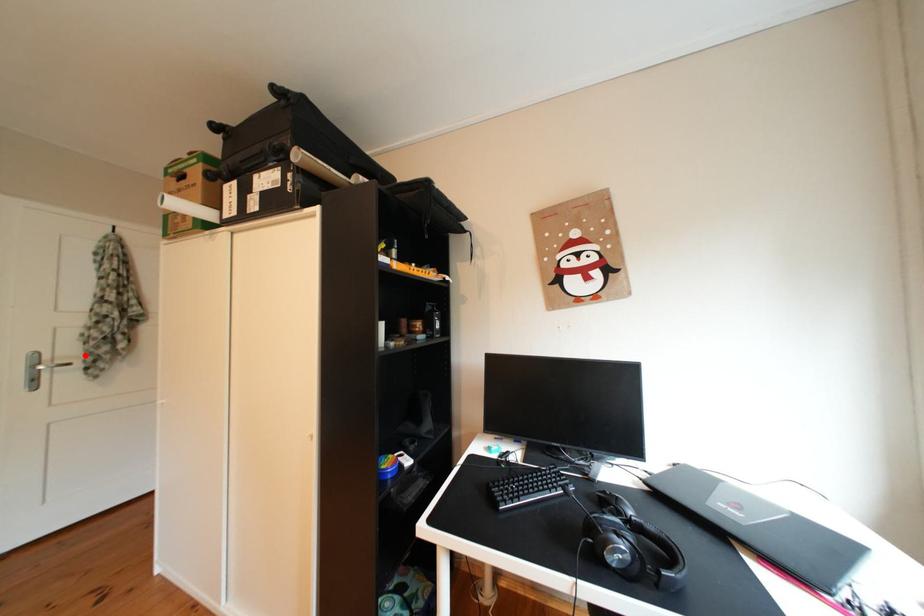
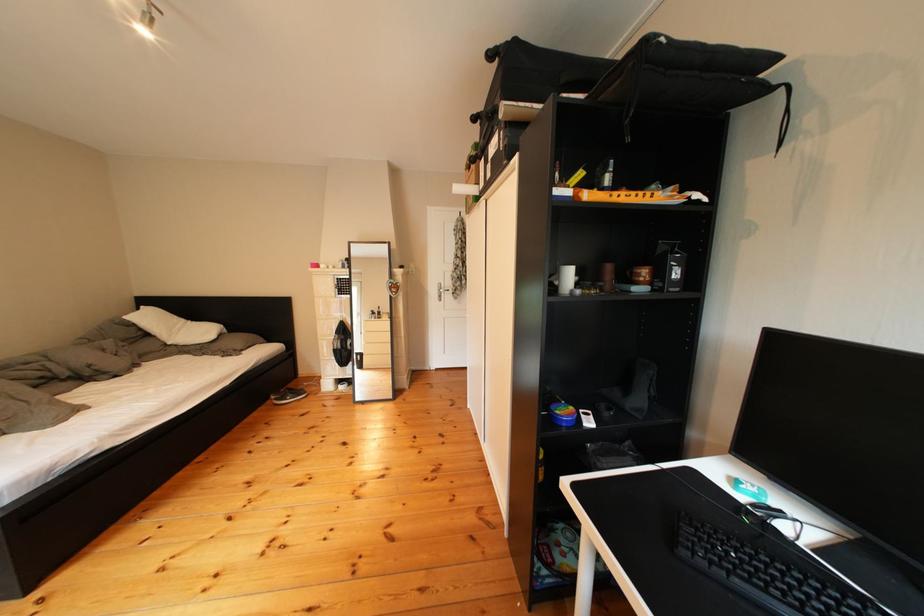
Locate, in the second image, the point that corresponds to the highlighted location in the first image.

(463, 288)